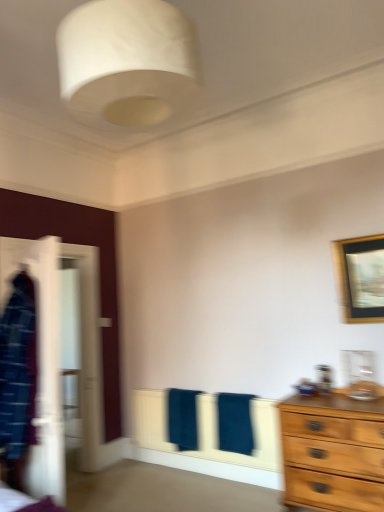
Question: Considering the relative sizes of dark blue towel at center, positioned as the 1th bath towel in left-to-right order, and white fabric lampshade at upper center in the image provided, is dark blue towel at center, positioned as the 1th bath towel in left-to-right order, wider than white fabric lampshade at upper center?

Choices:
 (A) yes
 (B) no

Answer: (B)

Question: Is dark blue towel at center, positioned as the 1th bath towel in left-to-right order, positioned behind white fabric lampshade at upper center?

Choices:
 (A) yes
 (B) no

Answer: (A)

Question: Considering the relative sizes of dark blue towel at center, positioned as the 1th bath towel in left-to-right order, and white fabric lampshade at upper center in the image provided, is dark blue towel at center, positioned as the 1th bath towel in left-to-right order, bigger than white fabric lampshade at upper center?

Choices:
 (A) yes
 (B) no

Answer: (B)

Question: Is dark blue towel at center, positioned as the 1th bath towel in left-to-right order, oriented away from white fabric lampshade at upper center?

Choices:
 (A) no
 (B) yes

Answer: (A)

Question: Is dark blue towel at center, positioned as the 1th bath towel in left-to-right order, at the left side of white fabric lampshade at upper center?

Choices:
 (A) no
 (B) yes

Answer: (A)

Question: Is the surface of dark blue towel at center, marked as the second bath towel in a right-to-left arrangement, in direct contact with white fabric lampshade at upper center?

Choices:
 (A) yes
 (B) no

Answer: (B)

Question: From the image's perspective, does wooden framed picture at upper right appear higher than dark blue towel at center, which appears as the 1th bath towel when viewed from the right?

Choices:
 (A) yes
 (B) no

Answer: (A)

Question: Is wooden framed picture at upper right next to dark blue towel at center, which appears as the 1th bath towel when viewed from the right, and touching it?

Choices:
 (A) no
 (B) yes

Answer: (A)

Question: Does wooden framed picture at upper right come behind dark blue towel at center, the 2th bath towel in the left-to-right sequence?

Choices:
 (A) no
 (B) yes

Answer: (A)

Question: From the image's perspective, is wooden framed picture at upper right under dark blue towel at center, the 2th bath towel in the left-to-right sequence?

Choices:
 (A) no
 (B) yes

Answer: (A)

Question: Does wooden framed picture at upper right have a lesser height compared to dark blue towel at center, which appears as the 1th bath towel when viewed from the right?

Choices:
 (A) yes
 (B) no

Answer: (B)

Question: Can you confirm if wooden framed picture at upper right is bigger than dark blue towel at center, the 2th bath towel in the left-to-right sequence?

Choices:
 (A) no
 (B) yes

Answer: (A)

Question: Does dark blue towel at center, the 2th bath towel in the left-to-right sequence, have a greater width compared to wooden framed picture at upper right?

Choices:
 (A) yes
 (B) no

Answer: (A)